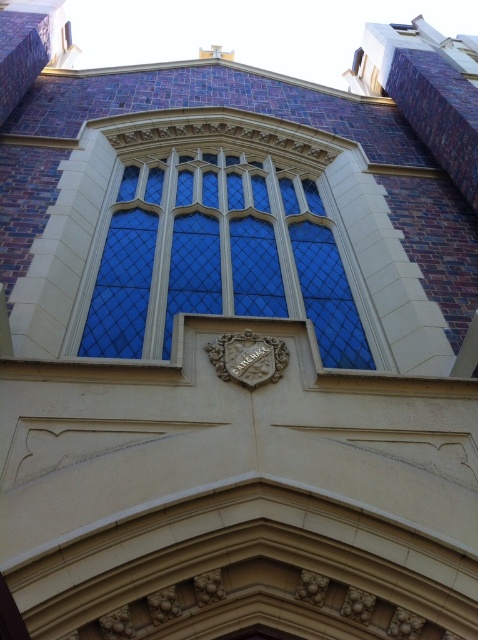
Question: Can you confirm if blue glass window at center is thinner than stone carved crest at center?

Choices:
 (A) no
 (B) yes

Answer: (A)

Question: Which of the following is the farthest from the observer?

Choices:
 (A) (239, 353)
 (B) (181, 214)

Answer: (B)

Question: Can you confirm if blue glass window at center is positioned to the right of stone carved crest at center?

Choices:
 (A) yes
 (B) no

Answer: (B)

Question: Does blue glass window at center appear on the right side of stone carved crest at center?

Choices:
 (A) yes
 (B) no

Answer: (B)

Question: Which point is closer to the camera?

Choices:
 (A) stone carved crest at center
 (B) blue glass window at center

Answer: (A)